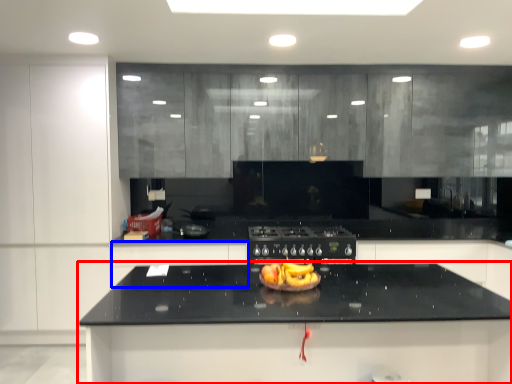
Question: Which object is further to the camera taking this photo, countertop (highlighted by a red box) or cabinetry (highlighted by a blue box)?

Choices:
 (A) countertop
 (B) cabinetry

Answer: (B)